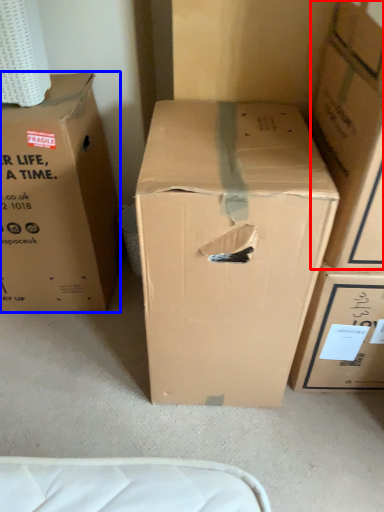
Question: Which object appears farthest to the camera in this image, box (highlighted by a red box) or box (highlighted by a blue box)?

Choices:
 (A) box
 (B) box

Answer: (B)